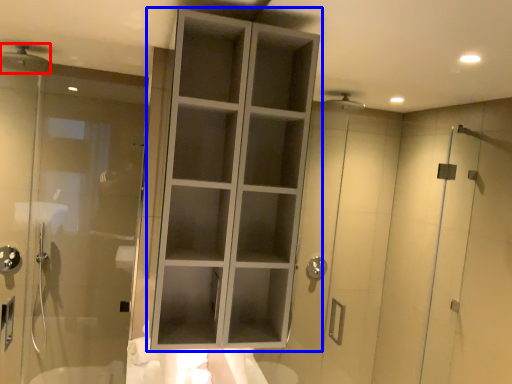
Question: Which point is further to the camera, shower (highlighted by a red box) or cupboard (highlighted by a blue box)?

Choices:
 (A) shower
 (B) cupboard

Answer: (A)